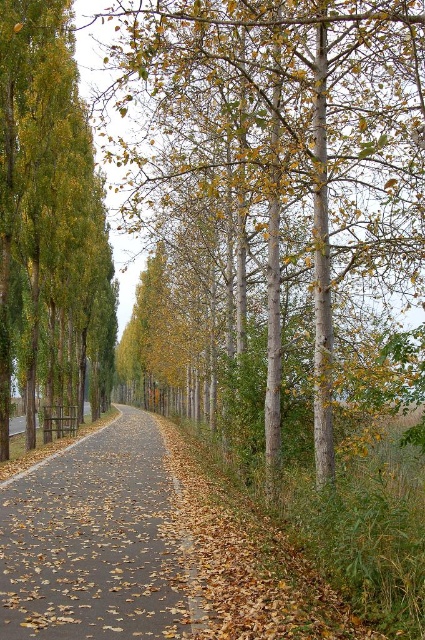
You are a hiker carrying a 5 meter long ladder. You need to place it between the smooth gray tree at center and the green glossy tree at left. Will the ladder fit between them?

The distance between the smooth gray tree at center and the green glossy tree at left is 5.79 meters. Since the ladder is 5 meters long, it will fit between them with 0.79 meters of space remaining.

You are a hiker carrying a 1.5 meter wide backpack. You want to walk along the path between the smooth gray tree at center and the green glossy tree at left. Can you pass through without the backpack hitting either tree?

The smooth gray tree at center is wider than the green glossy tree at left. Since the backpack is 1.5 meters wide, you need to ensure the space between them is at least that width. However, the description only compares their widths, not the distance between them. Without knowing the actual distance between the trees, it is impossible to determine if the backpack will fit.